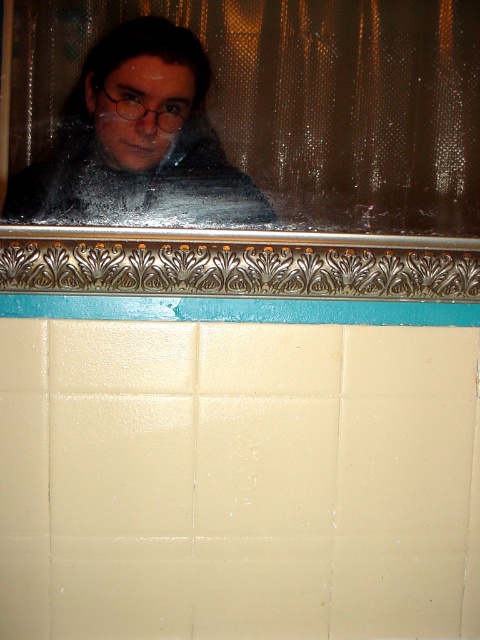
Can you confirm if metallic frame at upper center is shorter than matte black scarf at upper center?

In fact, metallic frame at upper center may be taller than matte black scarf at upper center.

At what (x,y) coordinates should I click in order to perform the action: click on metallic frame at upper center. Please return your answer as a coordinate pair (x, y). The image size is (480, 640). Looking at the image, I should click on (284, 148).

Is point (203, 35) positioned in front of point (188, 211)?

Yes, it is in front of point (188, 211).

This screenshot has width=480, height=640. I want to click on metallic frame at upper center, so click(284, 148).